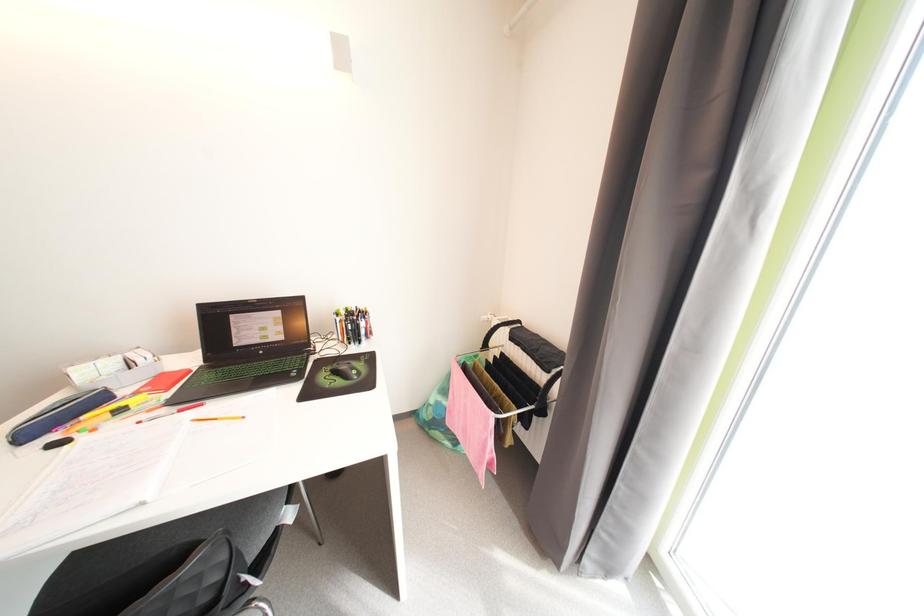
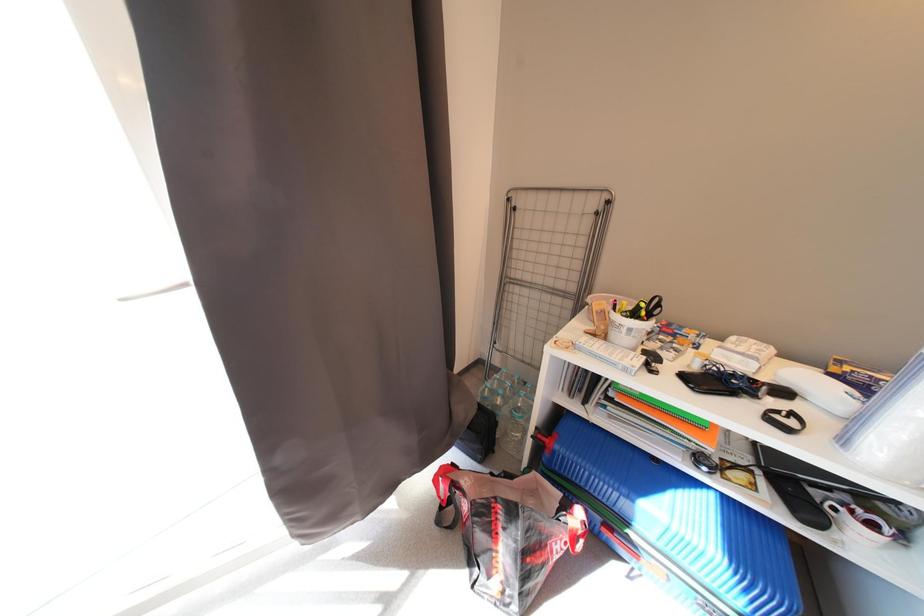
First-person continuous shooting, in which direction is the camera rotating?

The rotation direction of the camera is right-down.